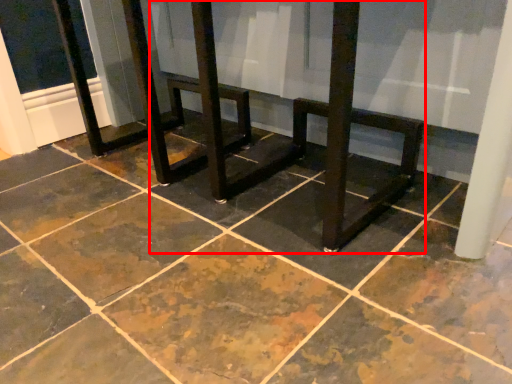
Question: From the image's perspective, what is the correct spatial relationship of round table (annotated by the red box) in relation to concrete?

Choices:
 (A) below
 (B) above

Answer: (B)